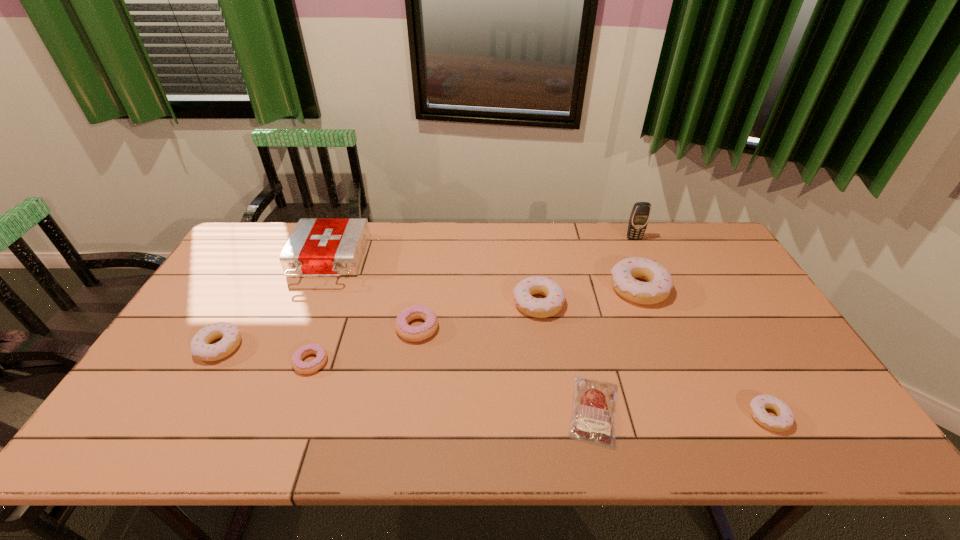
Where is `cellular telephone`? This screenshot has width=960, height=540. cellular telephone is located at coordinates (640, 214).

Locate an element on the screen. red first-aid kit is located at coordinates (317, 246).

At what (x,y) coordinates should I click in order to perform the action: click on the biggest white doughnut. Please return your answer as a coordinate pair (x, y). The width and height of the screenshot is (960, 540). Looking at the image, I should click on (657, 289).

You are a GUI agent. You are given a task and a screenshot of the screen. Output one action in this format:
    pyautogui.click(x=<x>, y=<y>)
    Task: Click on the tallest doughnut
    
    Given the screenshot: What is the action you would take?
    pyautogui.click(x=657, y=289)

Image resolution: width=960 pixels, height=540 pixels. I want to click on the sixth shortest object, so click(x=539, y=308).

The width and height of the screenshot is (960, 540). I want to click on the second biggest white doughnut, so click(539, 308).

Find the location of a particular element. This screenshot has width=960, height=540. the bigger pink doughnut is located at coordinates (410, 333).

Locate an element on the screen. the fourth object from left to right is located at coordinates (410, 333).

You are a GUI agent. You are given a task and a screenshot of the screen. Output one action in this format:
    pyautogui.click(x=<x>, y=<y>)
    Task: Click on the third biggest white doughnut
    Image resolution: width=960 pixels, height=540 pixels.
    Given the screenshot: What is the action you would take?
    pyautogui.click(x=200, y=346)

Where is `the leftmost white doughnut`? This screenshot has height=540, width=960. the leftmost white doughnut is located at coordinates (200, 346).